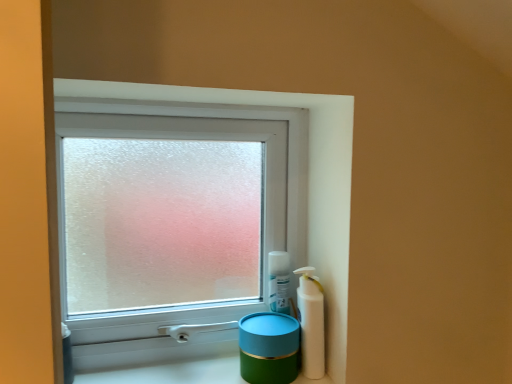
Locate an element on the screen. This screenshot has width=512, height=384. free space above green matte container at lower center (from a real-world perspective) is located at coordinates (211, 370).